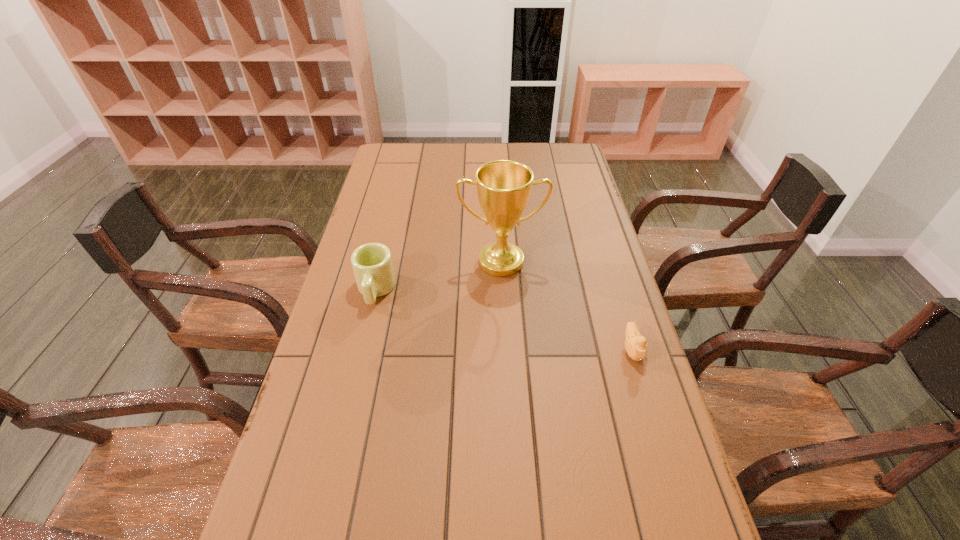
Locate an element on the screen. The image size is (960, 540). award is located at coordinates (503, 186).

Where is `the second object from left to right`? The height and width of the screenshot is (540, 960). the second object from left to right is located at coordinates (503, 186).

Where is `the leftmost object`? Image resolution: width=960 pixels, height=540 pixels. the leftmost object is located at coordinates (372, 264).

Locate an element on the screen. the second shortest object is located at coordinates (372, 264).

Image resolution: width=960 pixels, height=540 pixels. I want to click on duckling, so click(x=635, y=344).

Locate an element on the screen. the rightmost object is located at coordinates (635, 344).

Where is `free space located by the handles of the tallest object`? free space located by the handles of the tallest object is located at coordinates (508, 393).

Identify the location of free point located 0.110m with the handle on the side of the second shortest object. (363, 343).

The width and height of the screenshot is (960, 540). Find the location of `vacant space located 0.120m on the face of the nearest object`. vacant space located 0.120m on the face of the nearest object is located at coordinates (652, 412).

What are the coordinates of `object that is positioned at the left edge` in the screenshot? It's located at (372, 264).